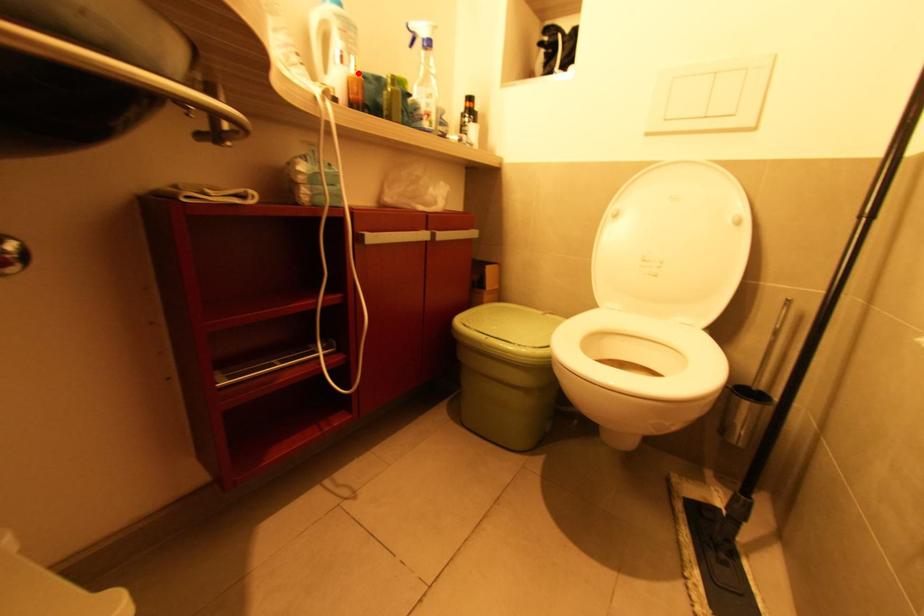
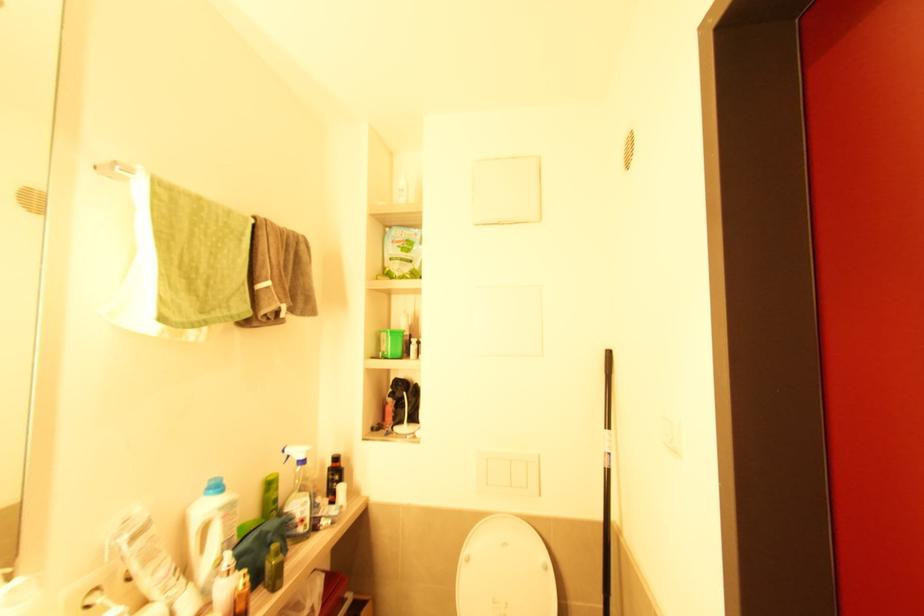
Locate, in the second image, the point that corresponds to the highlighted location in the first image.

(247, 585)